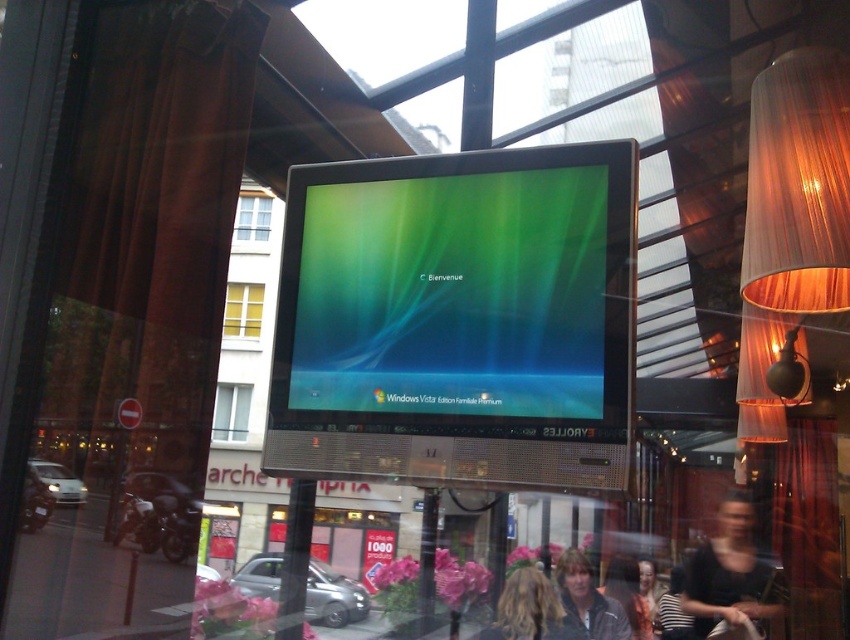
Question: Does matte black jacket at lower center lie in front of clear glass window at upper center?

Choices:
 (A) yes
 (B) no

Answer: (A)

Question: Does dark gray jacket at lower center come in front of striped shirt at center?

Choices:
 (A) yes
 (B) no

Answer: (A)

Question: Which point is closer to the camera?

Choices:
 (A) (539, 605)
 (B) (607, 628)

Answer: (A)

Question: From the image, what is the correct spatial relationship of green glossy monitor at center in relation to striped shirt at center?

Choices:
 (A) above
 (B) below

Answer: (A)

Question: Which point is farther from the camera taking this photo?

Choices:
 (A) (542, 576)
 (B) (242, 396)
 (C) (587, 230)

Answer: (B)

Question: Among these points, which one is nearest to the camera?

Choices:
 (A) (748, 611)
 (B) (244, 196)
 (C) (558, 604)

Answer: (C)